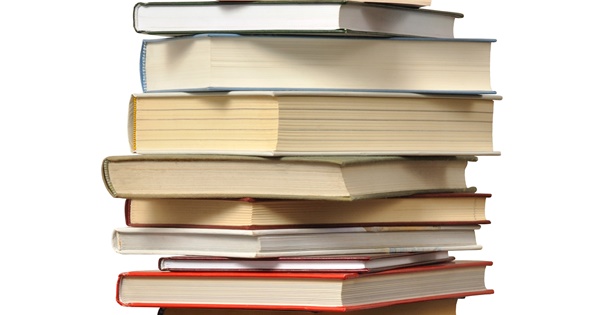
Where is `books`? The height and width of the screenshot is (315, 600). books is located at coordinates (256, 15), (247, 64), (279, 121), (292, 181), (252, 212), (253, 245), (314, 262), (316, 289), (419, 310).